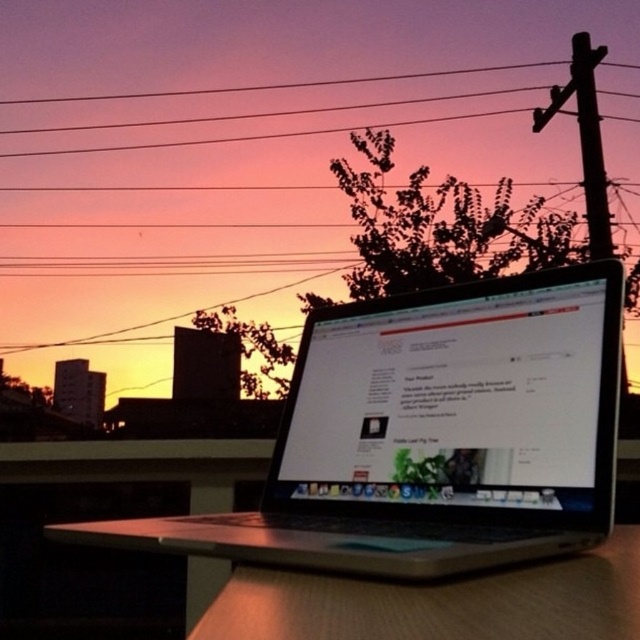
Is silver metallic laptop at center thinner than satin silver laptop at center?

No, silver metallic laptop at center is not thinner than satin silver laptop at center.

Is the position of silver metallic laptop at center more distant than that of satin silver laptop at center?

That is False.

Between point (524, 298) and point (500, 490), which one is positioned behind?

Point (524, 298)

Identify the location of silver metallic laptop at center. [432, 435].